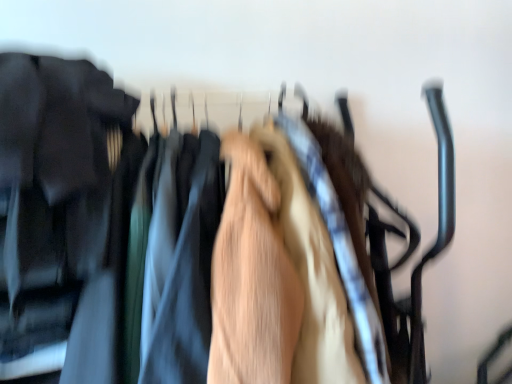
In order to face matte black shirt at left, should I rotate leftwards or rightwards?

You should rotate left by 23.375 degrees.

The height and width of the screenshot is (384, 512). Describe the element at coordinates (54, 172) in the screenshot. I see `matte black shirt at left` at that location.

What is the approximate height of matte black shirt at left?

22.18 inches.

Find the location of a particular element. This screenshot has width=512, height=384. matte black shirt at left is located at coordinates (54, 172).

This screenshot has height=384, width=512. Identify the location of matte black shirt at left. (54, 172).